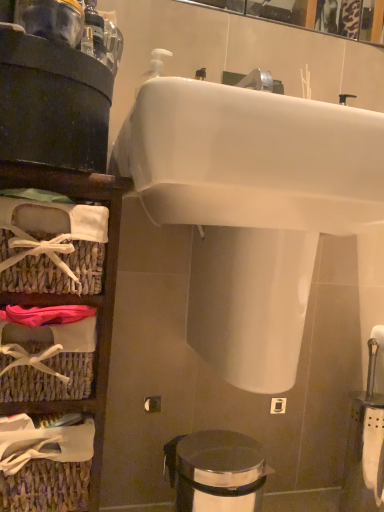
Question: Is white glossy sink at upper center inside or outside of polished stainless steel trash can at lower center?

Choices:
 (A) inside
 (B) outside

Answer: (B)

Question: In the image, is white glossy sink at upper center positioned in front of or behind polished stainless steel trash can at lower center?

Choices:
 (A) behind
 (B) front

Answer: (B)

Question: Which object is the closest to the polished stainless steel trash can at lower center?

Choices:
 (A) white glossy sink at upper center
 (B) woven wicker basket at left

Answer: (B)

Question: Which object is the farthest from the polished stainless steel trash can at lower center?

Choices:
 (A) white glossy sink at upper center
 (B) woven wicker basket at left

Answer: (A)